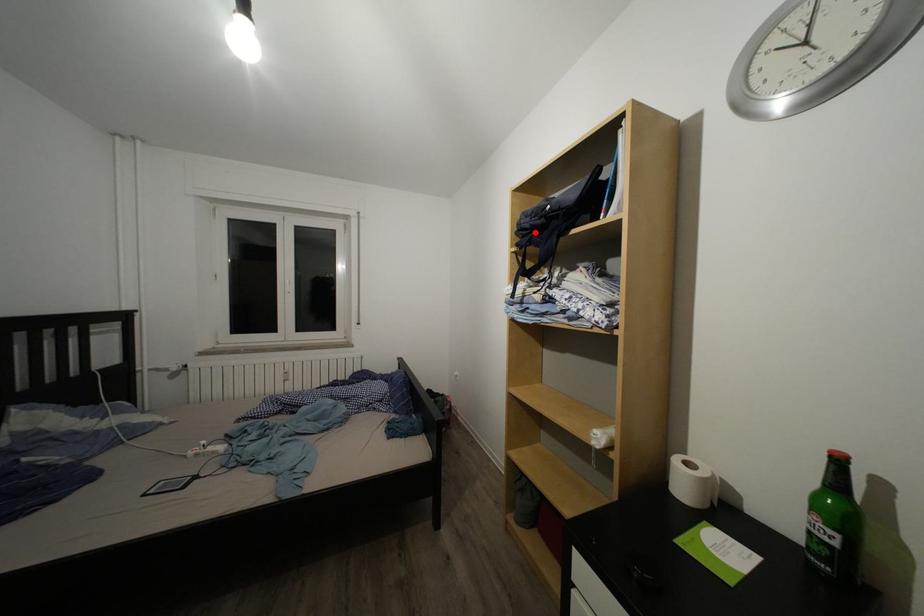
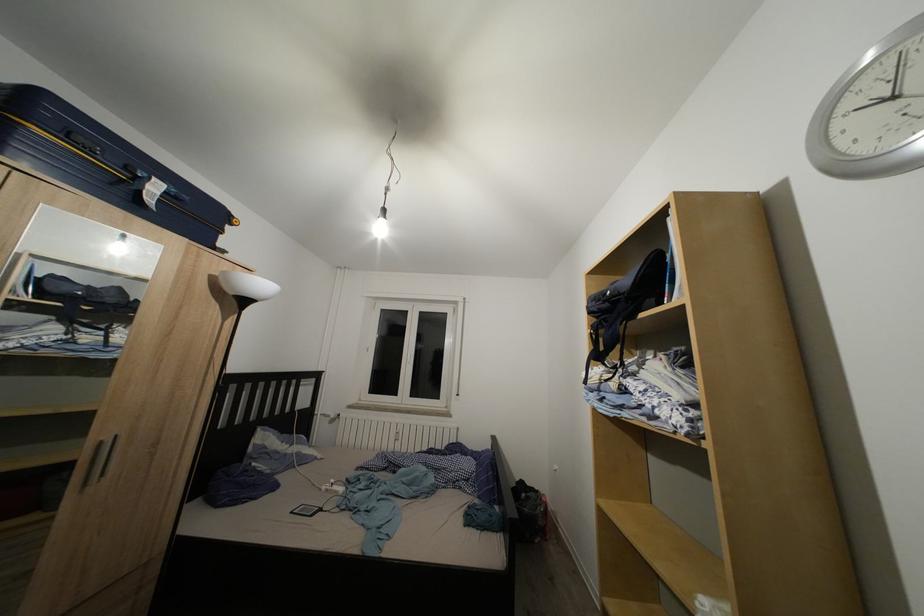
The point at the highlighted location is marked in the first image. Where is the corresponding point in the second image?

(602, 315)